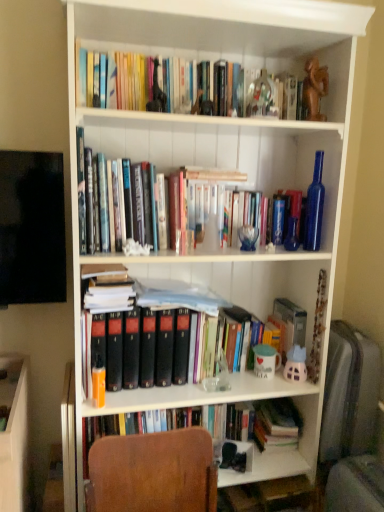
Question: Does hardcover books at upper center have a lesser height compared to brown wooden statue at upper center?

Choices:
 (A) yes
 (B) no

Answer: (A)

Question: Considering the relative sizes of hardcover books at upper center and brown wooden statue at upper center in the image provided, is hardcover books at upper center bigger than brown wooden statue at upper center?

Choices:
 (A) no
 (B) yes

Answer: (B)

Question: Can you confirm if hardcover books at upper center is thinner than brown wooden statue at upper center?

Choices:
 (A) no
 (B) yes

Answer: (A)

Question: Are hardcover books at upper center and brown wooden statue at upper center located far from each other?

Choices:
 (A) no
 (B) yes

Answer: (A)

Question: Is hardcover books at upper center facing away from brown wooden statue at upper center?

Choices:
 (A) no
 (B) yes

Answer: (A)

Question: Looking at their shapes, would you say orange matte book at left is wider or thinner than hardcover books at upper center?

Choices:
 (A) thin
 (B) wide

Answer: (A)

Question: Would you say orange matte book at left is inside or outside hardcover books at upper center?

Choices:
 (A) inside
 (B) outside

Answer: (B)

Question: In terms of size, does orange matte book at left appear bigger or smaller than hardcover books at upper center?

Choices:
 (A) small
 (B) big

Answer: (A)

Question: From their relative heights in the image, would you say orange matte book at left is taller or shorter than hardcover books at upper center?

Choices:
 (A) short
 (B) tall

Answer: (B)

Question: Considering the positions of point (97, 313) and point (309, 113), is point (97, 313) closer or farther from the camera than point (309, 113)?

Choices:
 (A) farther
 (B) closer

Answer: (B)

Question: From a real-world perspective, relative to brown wooden statue at upper center, is orange matte book at left vertically above or below?

Choices:
 (A) above
 (B) below

Answer: (B)

Question: From the image's perspective, relative to brown wooden statue at upper center, is orange matte book at left above or below?

Choices:
 (A) above
 (B) below

Answer: (B)

Question: Is orange matte book at left situated inside brown wooden statue at upper center or outside?

Choices:
 (A) outside
 (B) inside

Answer: (A)

Question: From the image's perspective, is brown wooden statue at upper center positioned above or below hardcover books at upper center?

Choices:
 (A) below
 (B) above

Answer: (A)

Question: Relative to hardcover books at upper center, is brown wooden statue at upper center in front or behind?

Choices:
 (A) behind
 (B) front

Answer: (A)